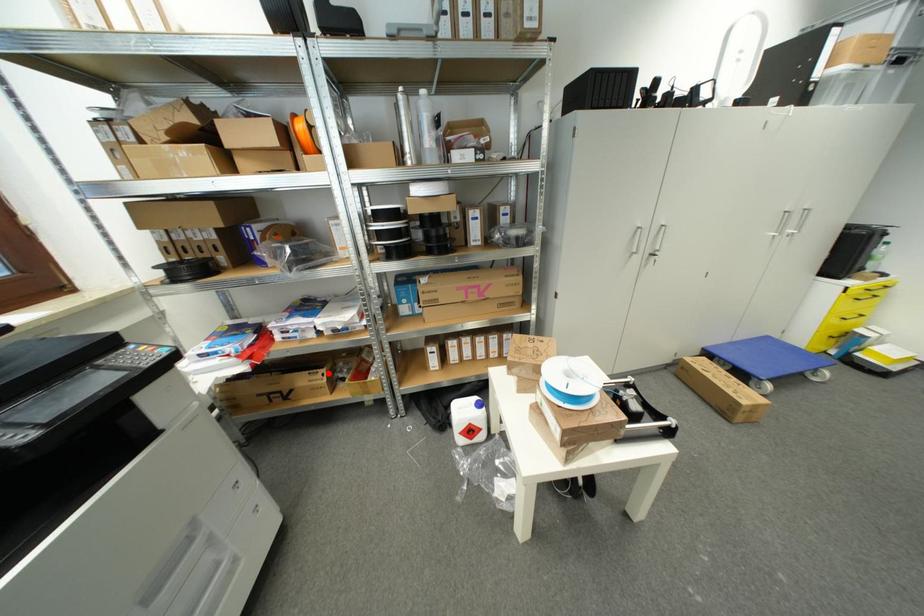
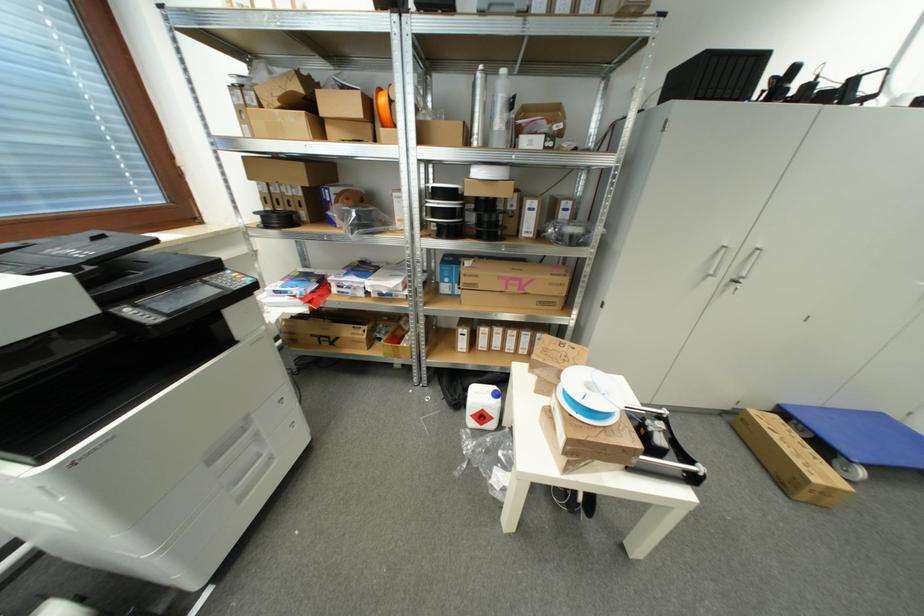
The point at the highlighted location is marked in the first image. Where is the corresponding point in the second image?

(370, 330)